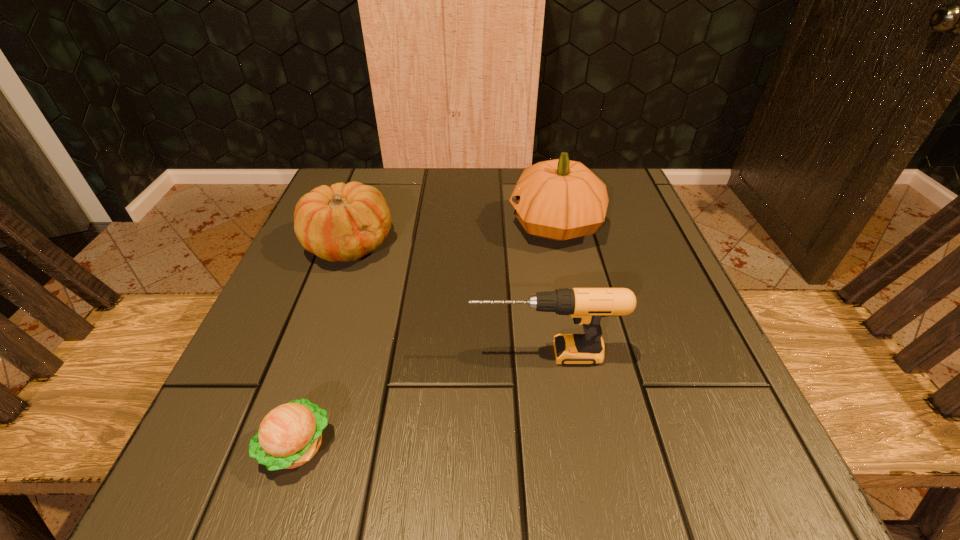
Find the location of a particular element. drill that is at the right edge is located at coordinates (586, 306).

This screenshot has height=540, width=960. Find the location of `object located at the far left corner`. object located at the far left corner is located at coordinates (344, 222).

Identify the location of object at the near left corner. This screenshot has height=540, width=960. (290, 435).

Find the location of `object positioned at the far right corner`. object positioned at the far right corner is located at coordinates (560, 199).

Where is `free space at the far edge`? free space at the far edge is located at coordinates (507, 221).

The width and height of the screenshot is (960, 540). Identify the location of vacant space at the near edge. (586, 460).

Locate an element on the screen. The height and width of the screenshot is (540, 960). vacant space at the left edge of the desktop is located at coordinates (348, 278).

In the image, there is a desktop. Where is `vacant space at the right edge`? The image size is (960, 540). vacant space at the right edge is located at coordinates (656, 329).

This screenshot has height=540, width=960. In the image, there is a desktop. Identify the location of vacant space at the far left corner. (354, 168).

The height and width of the screenshot is (540, 960). What are the coordinates of `free space at the near left corner` in the screenshot? It's located at point(197,477).